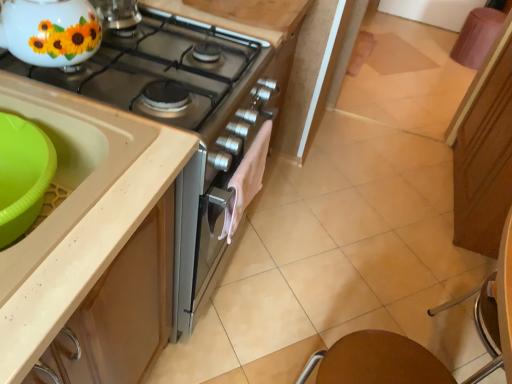
Locate an element on the screen. green plastic sink at lower left, positioned as the 1th sink in back-to-front order is located at coordinates (64, 140).

The width and height of the screenshot is (512, 384). In order to click on metallic silver chair at lower right in this screenshot , I will do `click(377, 361)`.

Describe the element at coordinates (162, 70) in the screenshot. I see `metallic silver gas stove at upper left` at that location.

Where is `pink fabric bar stool at upper right`? Image resolution: width=512 pixels, height=384 pixels. pink fabric bar stool at upper right is located at coordinates (477, 36).

Where is `white glossy teapot at upper left`? This screenshot has width=512, height=384. white glossy teapot at upper left is located at coordinates (50, 31).

Are green plastic sink at lower left, the 2th sink viewed from the front, and metallic silver chair at lower right beside each other?

green plastic sink at lower left, the 2th sink viewed from the front, is not next to metallic silver chair at lower right, and they're not touching.

Is green plastic sink at lower left, the 2th sink viewed from the front, positioned with its back to metallic silver chair at lower right?

No, green plastic sink at lower left, the 2th sink viewed from the front, is not facing the opposite direction of metallic silver chair at lower right.

There is a metallic silver chair at lower right. Where is `the 2nd sink above it (from the image's perspective)`? This screenshot has width=512, height=384. the 2nd sink above it (from the image's perspective) is located at coordinates (64, 140).

Which object is thinner, green plastic sink at lower left, positioned as the 1th sink in back-to-front order, or metallic silver gas stove at upper left?

green plastic sink at lower left, positioned as the 1th sink in back-to-front order, is thinner.

Is green plastic sink at lower left, the 2th sink viewed from the front, turned away from metallic silver gas stove at upper left?

That's not correct — green plastic sink at lower left, the 2th sink viewed from the front, is not looking away from metallic silver gas stove at upper left.

From the image's perspective, is green plastic sink at lower left, the 2th sink viewed from the front, on metallic silver gas stove at upper left?

No, from the image's perspective, green plastic sink at lower left, the 2th sink viewed from the front, is not above metallic silver gas stove at upper left.

From a real-world perspective, is pink fabric bar stool at upper right physically located above or below metallic silver chair at lower right?

pink fabric bar stool at upper right is below metallic silver chair at lower right.

Between pink fabric bar stool at upper right and metallic silver chair at lower right, which one appears on the right side from the viewer's perspective?

pink fabric bar stool at upper right is more to the right.

From the picture: How far apart are pink fabric bar stool at upper right and metallic silver chair at lower right?

pink fabric bar stool at upper right is 2.92 meters away from metallic silver chair at lower right.

Is pink fabric bar stool at upper right next to metallic silver chair at lower right and touching it?

pink fabric bar stool at upper right is not next to metallic silver chair at lower right, and they're not touching.

Who is taller, metallic silver gas stove at upper left or brown matte table at lower right?

Standing taller between the two is brown matte table at lower right.

Which of these two, metallic silver gas stove at upper left or brown matte table at lower right, is bigger?

metallic silver gas stove at upper left is bigger.

Between metallic silver gas stove at upper left and brown matte table at lower right, which one is positioned in front?

metallic silver gas stove at upper left is closer to the camera.

From the picture: Choose the correct answer: Is metallic silver gas stove at upper left inside brown matte table at lower right or outside it?

metallic silver gas stove at upper left lies outside brown matte table at lower right.

Which of these two, metallic silver gas stove at upper left or pink fabric bar stool at upper right, stands shorter?

Result: metallic silver gas stove at upper left is shorter.

Between metallic silver gas stove at upper left and pink fabric bar stool at upper right, which one has smaller width?

Thinner between the two is pink fabric bar stool at upper right.

Is point (170, 111) positioned behind point (483, 40)?

No, it is in front of (483, 40).

Between metallic silver gas stove at upper left and pink fabric bar stool at upper right, which one appears on the right side from the viewer's perspective?

Positioned to the right is pink fabric bar stool at upper right.

How much distance is there between metallic silver chair at lower right and brown matte table at lower right?

A distance of 3.18 centimeters exists between metallic silver chair at lower right and brown matte table at lower right.

From the image's perspective, would you say metallic silver chair at lower right is positioned over brown matte table at lower right?

Indeed, from the image's perspective, metallic silver chair at lower right is shown above brown matte table at lower right.

Considering the relative sizes of metallic silver chair at lower right and brown matte table at lower right in the image provided, is metallic silver chair at lower right bigger than brown matte table at lower right?

Correct, metallic silver chair at lower right is larger in size than brown matte table at lower right.

From a real-world perspective, is metallic silver chair at lower right physically located above or below brown matte table at lower right?

In terms of real-world spatial position, metallic silver chair at lower right is above brown matte table at lower right.

Is pink fabric bar stool at upper right facing away from green plastic sink at lower left, the 2th sink viewed from the front?

No, green plastic sink at lower left, the 2th sink viewed from the front, is not at the back of pink fabric bar stool at upper right.

Locate an element on the screen. The height and width of the screenshot is (384, 512). bar stool that appears above the green plastic sink at lower left, positioned as the 1th sink in back-to-front order (from the image's perspective) is located at coordinates (477, 36).

Can you confirm if pink fabric bar stool at upper right is bigger than green plastic sink at lower left, positioned as the 1th sink in back-to-front order?

Indeed, pink fabric bar stool at upper right has a larger size compared to green plastic sink at lower left, positioned as the 1th sink in back-to-front order.

This screenshot has height=384, width=512. I want to click on chair below the green plastic sink at lower left, positioned as the 1th sink in back-to-front order (from a real-world perspective), so click(x=377, y=361).

At what (x,y) coordinates should I click in order to perform the action: click on gas stove behind the green plastic sink at lower left, the 2th sink viewed from the front. Please return your answer as a coordinate pair (x, y). The image size is (512, 384). Looking at the image, I should click on (162, 70).

From the image, which object appears to be farther from metallic silver gas stove at upper left, metallic silver chair at lower right or brown matte table at lower right?

The object further to metallic silver gas stove at upper left is metallic silver chair at lower right.

Considering their positions, is pink fabric bar stool at upper right positioned further to beige plastic sink at left, the first sink positioned from the front, than metallic silver gas stove at upper left?

Among the two, pink fabric bar stool at upper right is located further to beige plastic sink at left, the first sink positioned from the front.

Which object lies further to the anchor point white glossy teapot at upper left, metallic silver chair at lower right or metallic silver gas stove at upper left?

metallic silver chair at lower right is positioned further to the anchor white glossy teapot at upper left.

From the image, which object appears to be nearer to beige plastic sink at left, which is the 2th sink from back to front, metallic silver gas stove at upper left or brown matte table at lower right?

Among the two, metallic silver gas stove at upper left is located nearer to beige plastic sink at left, which is the 2th sink from back to front.

Estimate the real-world distances between objects in this image. Which object is further from metallic silver gas stove at upper left, green plastic sink at lower left, positioned as the 1th sink in back-to-front order, or beige plastic sink at left, which is the 2th sink from back to front?

Based on the image, green plastic sink at lower left, positioned as the 1th sink in back-to-front order, appears to be further to metallic silver gas stove at upper left.

Which object lies further to the anchor point beige plastic sink at left, the first sink positioned from the front, green plastic sink at lower left, the 2th sink viewed from the front, or white glossy teapot at upper left?

white glossy teapot at upper left is positioned further to the anchor beige plastic sink at left, the first sink positioned from the front.

Which object lies further to the anchor point pink fabric bar stool at upper right, green plastic sink at lower left, positioned as the 1th sink in back-to-front order, or brown matte table at lower right?

green plastic sink at lower left, positioned as the 1th sink in back-to-front order.

Based on their spatial positions, is pink fabric bar stool at upper right or metallic silver gas stove at upper left further from white glossy teapot at upper left?

pink fabric bar stool at upper right is positioned further to the anchor white glossy teapot at upper left.

In order to click on round table situated between green plastic sink at lower left, positioned as the 1th sink in back-to-front order, and metallic silver chair at lower right from left to right in this screenshot , I will do [x=376, y=361].

You are a GUI agent. You are given a task and a screenshot of the screen. Output one action in this format:
    pyautogui.click(x=<x>, y=<y>)
    Task: Click on the gas stove situated between white glossy teapot at upper left and metallic silver chair at lower right from left to right
    
    Given the screenshot: What is the action you would take?
    162,70

In order to click on sink between white glossy teapot at upper left and beige plastic sink at left, the first sink positioned from the front, in the vertical direction in this screenshot , I will do `click(64, 140)`.

Image resolution: width=512 pixels, height=384 pixels. In order to click on sink between green plastic sink at lower left, positioned as the 1th sink in back-to-front order, and brown matte table at lower right in this screenshot , I will do `click(70, 170)`.